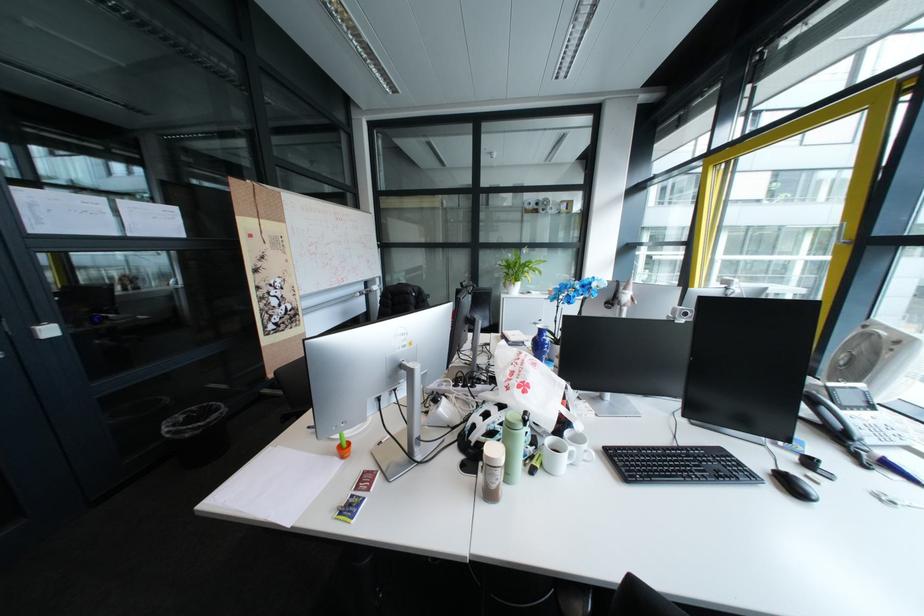
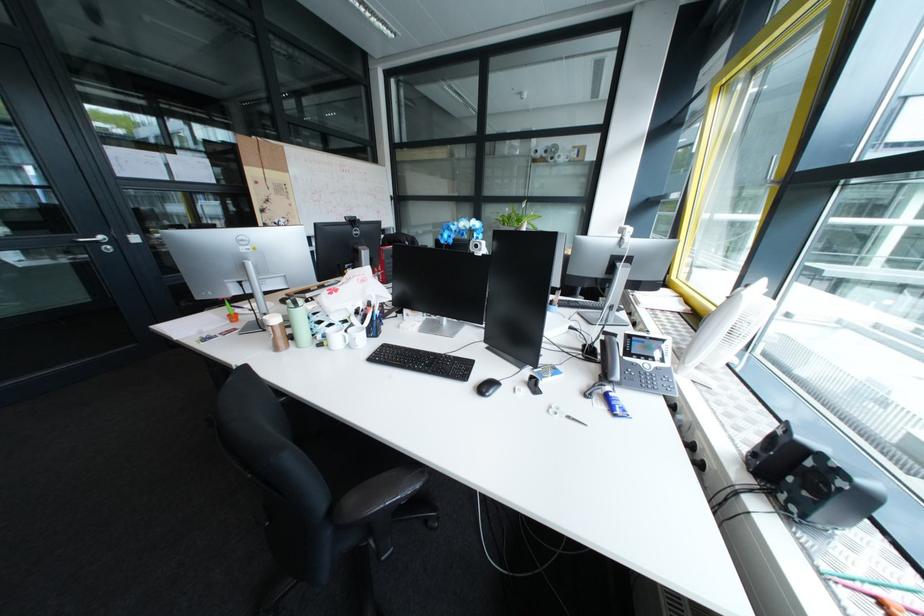
Question: I am providing you with two images of the same scene from different viewpoints. Which of the following objects are not visible in image2?

Choices:
 (A) brown plastic shaker
 (B) blue tablet case
 (C) white desk fan
 (D) black webcam

Answer: (A)